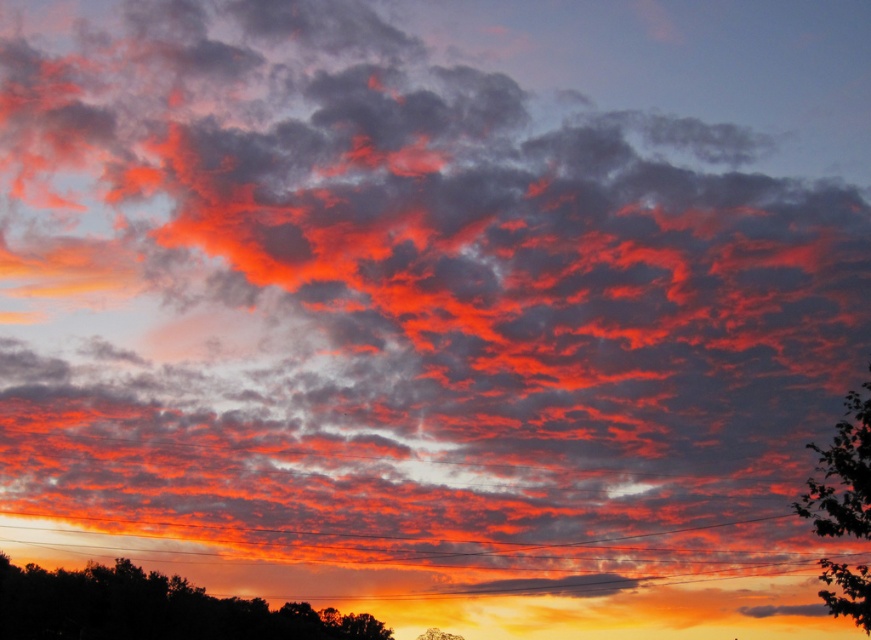
Question: Which of the following is the farthest from the observer?

Choices:
 (A) (865, 394)
 (B) (130, 582)

Answer: (B)

Question: Is green leafy tree at right bigger than green leafy tree at lower center?

Choices:
 (A) yes
 (B) no

Answer: (B)

Question: Is dark green leafy tree at lower left to the right of green leafy tree at lower center from the viewer's perspective?

Choices:
 (A) no
 (B) yes

Answer: (A)

Question: Which of the following is the farthest from the observer?

Choices:
 (A) green leafy tree at right
 (B) green leafy tree at lower center
 (C) dark green leafy tree at lower left

Answer: (C)

Question: Which point is farther from the camera taking this photo?

Choices:
 (A) (179, 618)
 (B) (815, 515)
 (C) (434, 627)

Answer: (A)

Question: Does green leafy tree at right have a larger size compared to green leafy tree at lower center?

Choices:
 (A) yes
 (B) no

Answer: (B)